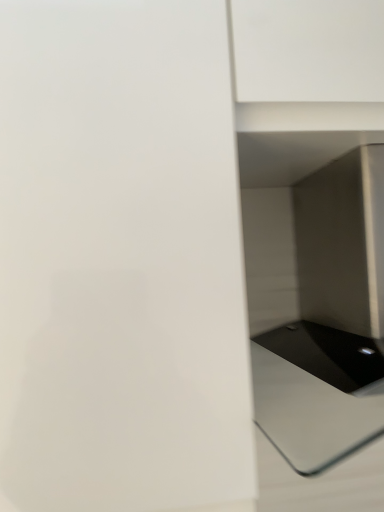
What do you see at coordinates (318, 307) in the screenshot?
I see `black glossy mirror at right` at bounding box center [318, 307].

Image resolution: width=384 pixels, height=512 pixels. Find the location of `black glossy mirror at right`. black glossy mirror at right is located at coordinates click(318, 307).

Find the location of a particular element. This screenshot has height=512, width=384. black glossy mirror at right is located at coordinates (318, 307).